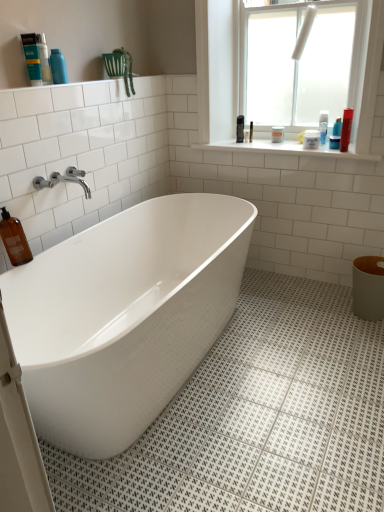
Question: Should I look upward or downward to see brown glass bottle at lower left, the fourth cleaning product in the right-to-left sequence?

Choices:
 (A) up
 (B) down

Answer: (A)

Question: Does white frosted glass at upper right appear on the left side of white tile at upper center?

Choices:
 (A) no
 (B) yes

Answer: (A)

Question: Is white frosted glass at upper right bigger than white tile at upper center?

Choices:
 (A) yes
 (B) no

Answer: (A)

Question: Considering the relative sizes of white frosted glass at upper right and white tile at upper center in the image provided, is white frosted glass at upper right thinner than white tile at upper center?

Choices:
 (A) yes
 (B) no

Answer: (A)

Question: Is white frosted glass at upper right looking in the opposite direction of white tile at upper center?

Choices:
 (A) yes
 (B) no

Answer: (B)

Question: Is white frosted glass at upper right outside white tile at upper center?

Choices:
 (A) yes
 (B) no

Answer: (A)

Question: Can you confirm if white frosted glass at upper right is smaller than white tile at upper center?

Choices:
 (A) no
 (B) yes

Answer: (A)

Question: Could you tell me if blue glossy lotion at upper right, placed as the fourth toiletry when sorted from back to front, is turned towards white matte jar at upper right, the 1th toiletry when ordered from back to front?

Choices:
 (A) no
 (B) yes

Answer: (A)

Question: Is blue glossy lotion at upper right, positioned as the second toiletry in front-to-back order, thinner than white matte jar at upper right, arranged as the 2th toiletry when viewed from the left?

Choices:
 (A) yes
 (B) no

Answer: (A)

Question: Is the position of blue glossy lotion at upper right, positioned as the second toiletry in front-to-back order, less distant than that of white matte jar at upper right, which appears as the 5th toiletry when viewed from the front?

Choices:
 (A) no
 (B) yes

Answer: (B)

Question: From a real-world perspective, is blue glossy lotion at upper right, acting as the 4th toiletry starting from the left, located higher than white matte jar at upper right, the 1th toiletry when ordered from back to front?

Choices:
 (A) no
 (B) yes

Answer: (A)

Question: Is blue glossy lotion at upper right, placed as the fourth toiletry when sorted from back to front, wider than white matte jar at upper right, arranged as the 2th toiletry when viewed from the left?

Choices:
 (A) no
 (B) yes

Answer: (A)

Question: Is the position of blue glossy lotion at upper right, placed as the fourth toiletry when sorted from back to front, more distant than that of white matte jar at upper right, arranged as the 2th toiletry when viewed from the left?

Choices:
 (A) no
 (B) yes

Answer: (A)

Question: Is chrome metallic faucet at upper left further to camera compared to blue glossy bottle at upper left, marked as the 5th toiletry in a back-to-front arrangement?

Choices:
 (A) yes
 (B) no

Answer: (B)